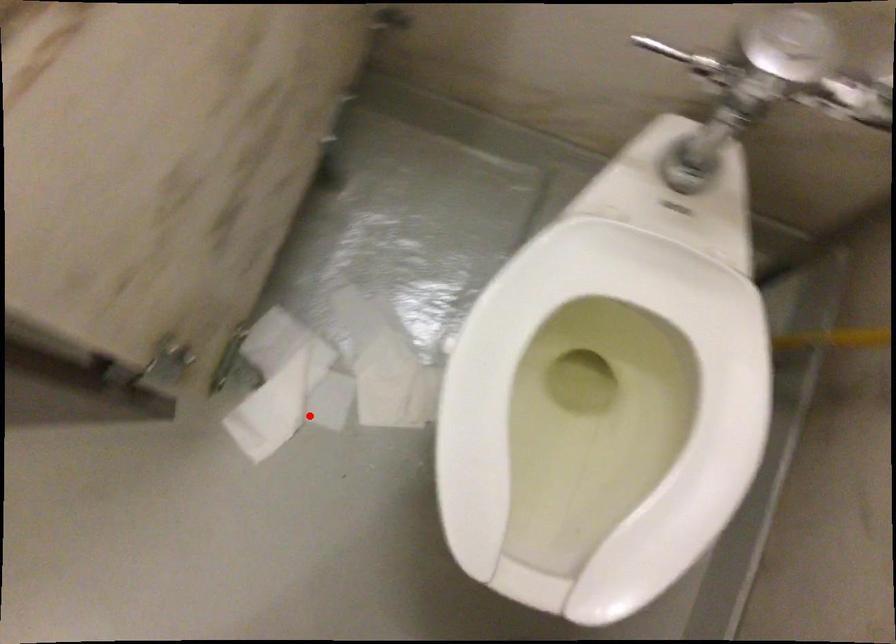
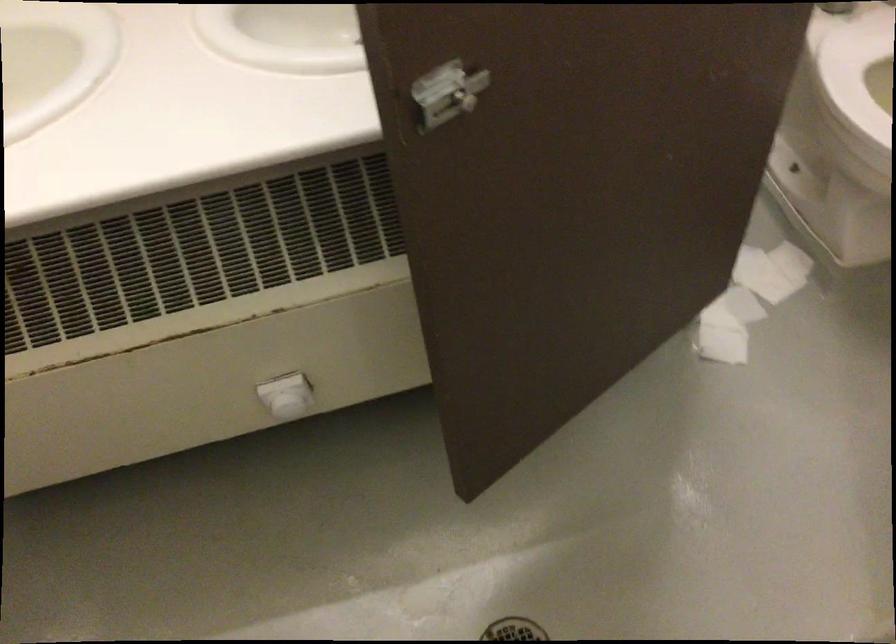
Question: I am providing you with two images of the same scene from different viewpoints. Given a red point in image1, look at the same physical point in image2. Is it:

Choices:
 (A) Closer to the viewpoint
 (B) Farther from the viewpoint

Answer: (B)